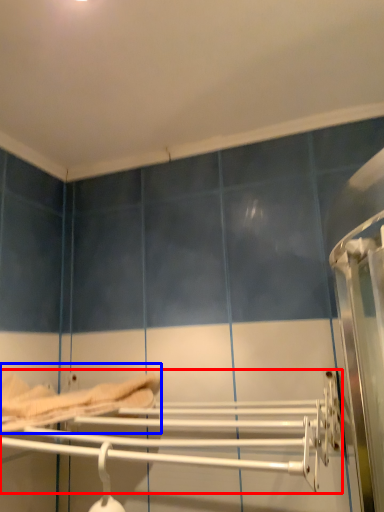
Question: Which object is further to the camera taking this photo, towel rack (highlighted by a red box) or bed (highlighted by a blue box)?

Choices:
 (A) towel rack
 (B) bed

Answer: (B)